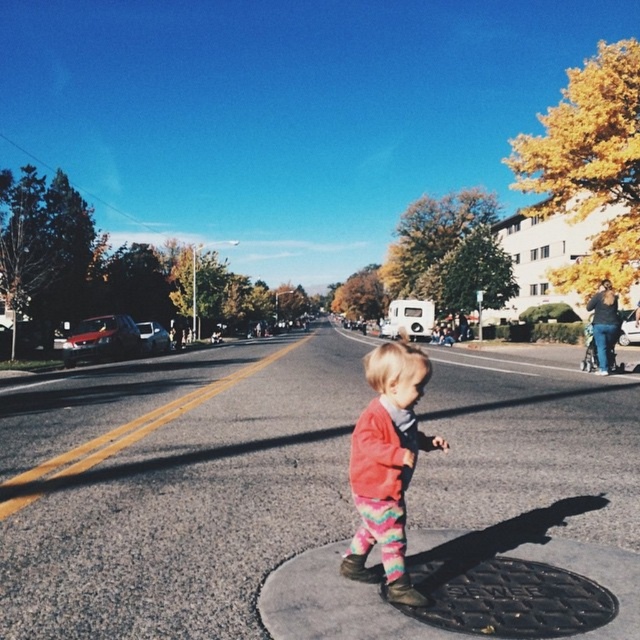
Does point (372, 426) lie behind point (436, 556)?

No, (372, 426) is in front of (436, 556).

What do you see at coordinates (387, 465) in the screenshot? I see `red sweater at center` at bounding box center [387, 465].

Which is behind, point (426, 602) or point (524, 616)?

The point (426, 602) is behind.

Find the location of a particular element. The image size is (640, 640). red sweater at center is located at coordinates (387, 465).